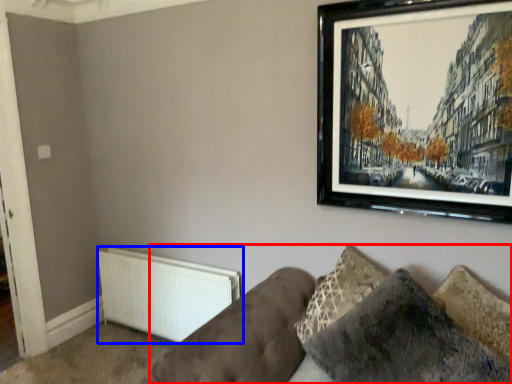
Question: Which object appears farthest to the camera in this image, studio couch (highlighted by a red box) or radiator (highlighted by a blue box)?

Choices:
 (A) studio couch
 (B) radiator

Answer: (B)